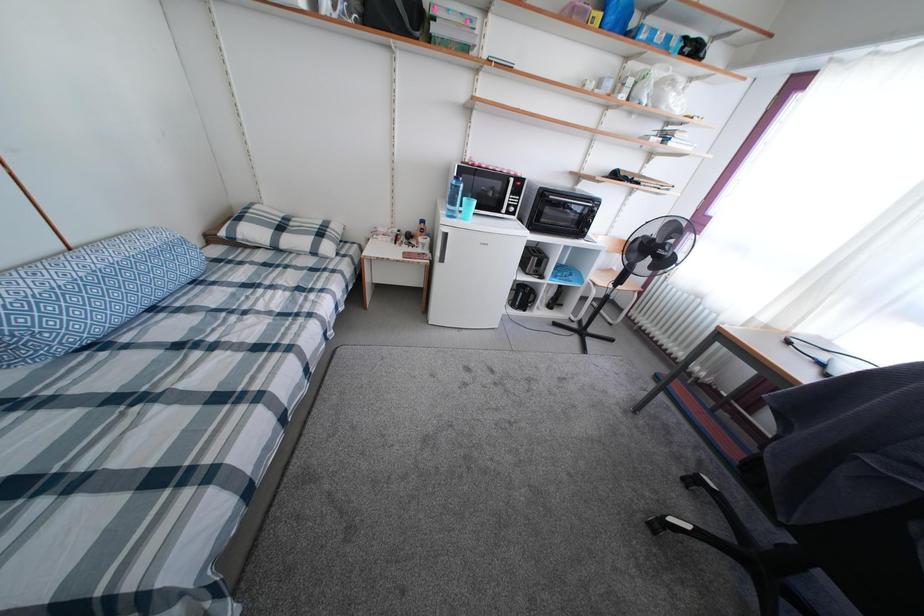
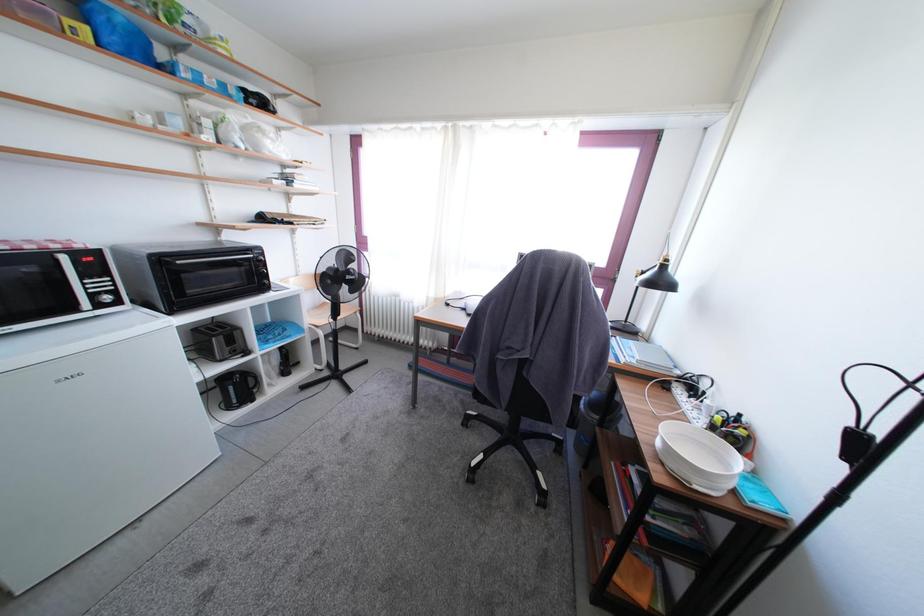
Question: The first image is from the beginning of the video and the second image is from the end. How did the camera likely rotate when shooting the video?

Choices:
 (A) Left
 (B) Right
 (C) Up
 (D) Down

Answer: (B)